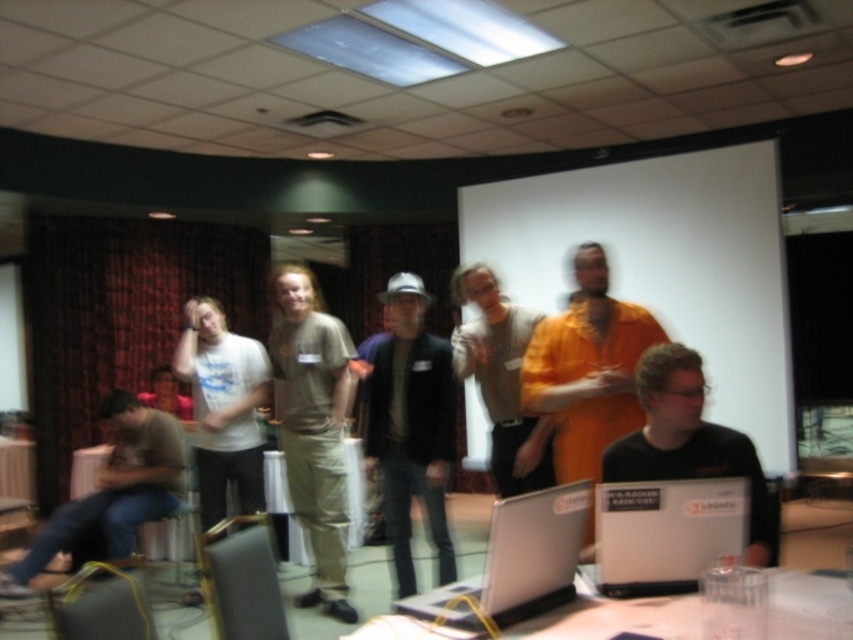
Question: Which point is farther to the camera?

Choices:
 (A) orange matte shirt at center
 (B) metallic silver laptop at lower center

Answer: (A)

Question: Which of the following is the farthest from the observer?

Choices:
 (A) wooden table at lower left
 (B) white glossy table at lower center

Answer: (A)

Question: Which point appears farthest from the camera in this image?

Choices:
 (A) (310, 344)
 (B) (451, 406)
 (C) (175, 410)

Answer: (C)

Question: Can you confirm if matte black jacket at center is positioned above gray cotton shirt at center?

Choices:
 (A) yes
 (B) no

Answer: (B)

Question: Is gray cotton shirt at center below metallic silver laptop at lower center?

Choices:
 (A) no
 (B) yes

Answer: (A)

Question: Is wooden table at lower left smaller than matte white shirt at center?

Choices:
 (A) no
 (B) yes

Answer: (B)